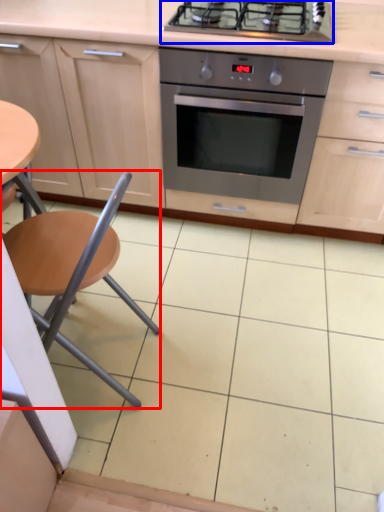
Question: Which object is closer to the camera taking this photo, chair (highlighted by a red box) or gas stove (highlighted by a blue box)?

Choices:
 (A) chair
 (B) gas stove

Answer: (A)